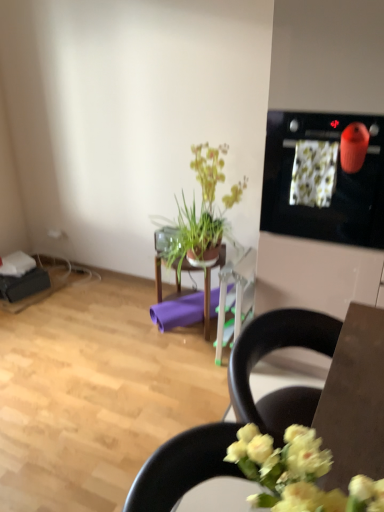
Question: Is wooden table at center looking in the opposite direction of purple matte yoga mat at center?

Choices:
 (A) no
 (B) yes

Answer: (B)

Question: From a real-world perspective, is wooden table at center positioned under purple matte yoga mat at center based on gravity?

Choices:
 (A) no
 (B) yes

Answer: (A)

Question: Is wooden table at center completely or partially outside of purple matte yoga mat at center?

Choices:
 (A) yes
 (B) no

Answer: (A)

Question: Is wooden table at center next to purple matte yoga mat at center?

Choices:
 (A) no
 (B) yes

Answer: (B)

Question: Does wooden table at center have a larger size compared to purple matte yoga mat at center?

Choices:
 (A) no
 (B) yes

Answer: (B)

Question: Is green leafy plant at center taller or shorter than purple matte yoga mat at center?

Choices:
 (A) tall
 (B) short

Answer: (A)

Question: Considering the positions of point (192, 224) and point (163, 322), is point (192, 224) closer or farther from the camera than point (163, 322)?

Choices:
 (A) closer
 (B) farther

Answer: (A)

Question: Looking at the image, does green leafy plant at center seem bigger or smaller compared to purple matte yoga mat at center?

Choices:
 (A) big
 (B) small

Answer: (A)

Question: From the image's perspective, is green leafy plant at center positioned above or below purple matte yoga mat at center?

Choices:
 (A) above
 (B) below

Answer: (A)

Question: Relative to purple matte yoga mat at center, is wooden table at center in front or behind?

Choices:
 (A) behind
 (B) front

Answer: (B)

Question: Is wooden table at center inside or outside of purple matte yoga mat at center?

Choices:
 (A) outside
 (B) inside

Answer: (A)

Question: In terms of height, does wooden table at center look taller or shorter compared to purple matte yoga mat at center?

Choices:
 (A) short
 (B) tall

Answer: (B)

Question: From the image's perspective, is wooden table at center positioned above or below purple matte yoga mat at center?

Choices:
 (A) below
 (B) above

Answer: (B)

Question: From their relative heights in the image, would you say purple matte yoga mat at center is taller or shorter than black plastic chair at lower right?

Choices:
 (A) tall
 (B) short

Answer: (B)

Question: From a real-world perspective, is purple matte yoga mat at center above or below black plastic chair at lower right?

Choices:
 (A) below
 (B) above

Answer: (A)